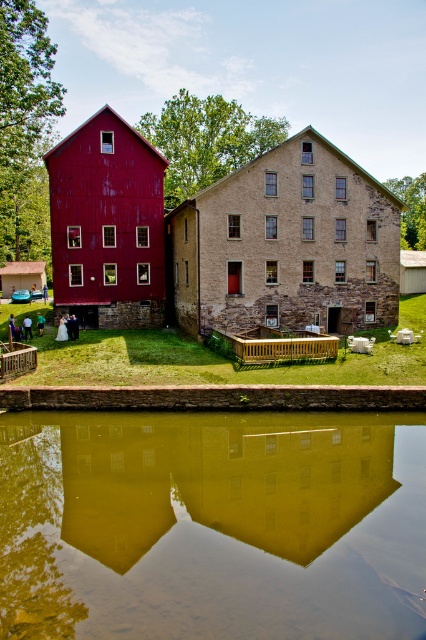
Question: Estimate the real-world distances between objects in this image. Which object is farther from the green reflective water at center?

Choices:
 (A) matte red barn at left
 (B) brown stone barn at center

Answer: (A)

Question: Among these objects, which one is farthest from the camera?

Choices:
 (A) green reflective water at center
 (B) matte red barn at left
 (C) brown stone barn at center

Answer: (B)

Question: Where is green reflective water at center located in relation to matte red barn at left in the image?

Choices:
 (A) above
 (B) below

Answer: (B)

Question: Where is brown stone barn at center located in relation to matte red barn at left in the image?

Choices:
 (A) left
 (B) right

Answer: (B)

Question: Does green reflective water at center have a greater width compared to matte red barn at left?

Choices:
 (A) yes
 (B) no

Answer: (A)

Question: Which object is positioned closest to the matte red barn at left?

Choices:
 (A) brown stone barn at center
 (B) green reflective water at center

Answer: (A)